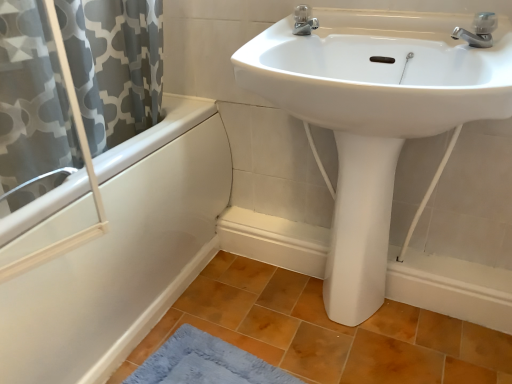
Question: In which direction should I rotate to look at silver metallic faucet at upper center, the 1th tap when ordered from back to front?

Choices:
 (A) left
 (B) right

Answer: (B)

Question: Does silver metallic faucet at upper center, the 1th tap when ordered from back to front, have a lesser width compared to white glossy pedestal at center?

Choices:
 (A) no
 (B) yes

Answer: (B)

Question: Is silver metallic faucet at upper center, which appears as the 2th tap when viewed from the right, to the right of white glossy pedestal at center from the viewer's perspective?

Choices:
 (A) no
 (B) yes

Answer: (A)

Question: Is the depth of silver metallic faucet at upper center, placed as the 2th tap when sorted from front to back, greater than that of white glossy pedestal at center?

Choices:
 (A) no
 (B) yes

Answer: (B)

Question: Is silver metallic faucet at upper center, which appears as the 2th tap when viewed from the right, oriented towards white glossy pedestal at center?

Choices:
 (A) no
 (B) yes

Answer: (A)

Question: From a real-world perspective, is silver metallic faucet at upper center, which appears as the 2th tap when viewed from the right, over white glossy pedestal at center?

Choices:
 (A) no
 (B) yes

Answer: (B)

Question: From a real-world perspective, is silver metallic faucet at upper center, marked as the 1th tap in a left-to-right arrangement, under white glossy pedestal at center?

Choices:
 (A) yes
 (B) no

Answer: (B)

Question: Does blue plush bath mat at lower left come in front of silver metallic faucet at upper right, arranged as the 2th tap when viewed from the left?

Choices:
 (A) yes
 (B) no

Answer: (B)

Question: From the image's perspective, is blue plush bath mat at lower left on top of silver metallic faucet at upper right, which is counted as the first tap, starting from the right?

Choices:
 (A) yes
 (B) no

Answer: (B)

Question: Is there a large distance between blue plush bath mat at lower left and silver metallic faucet at upper right, arranged as the 2th tap when viewed from the left?

Choices:
 (A) no
 (B) yes

Answer: (B)

Question: Is the depth of blue plush bath mat at lower left greater than that of silver metallic faucet at upper right, which is counted as the first tap, starting from the right?

Choices:
 (A) no
 (B) yes

Answer: (B)

Question: Is blue plush bath mat at lower left wider than silver metallic faucet at upper right, arranged as the 2th tap when viewed from the left?

Choices:
 (A) yes
 (B) no

Answer: (A)

Question: Is blue plush bath mat at lower left positioned beyond the bounds of silver metallic faucet at upper right, which is counted as the first tap, starting from the right?

Choices:
 (A) yes
 (B) no

Answer: (A)

Question: From a real-world perspective, is silver metallic faucet at upper right, arranged as the 2th tap when viewed from the left, physically above white glossy bathtub at left?

Choices:
 (A) yes
 (B) no

Answer: (A)